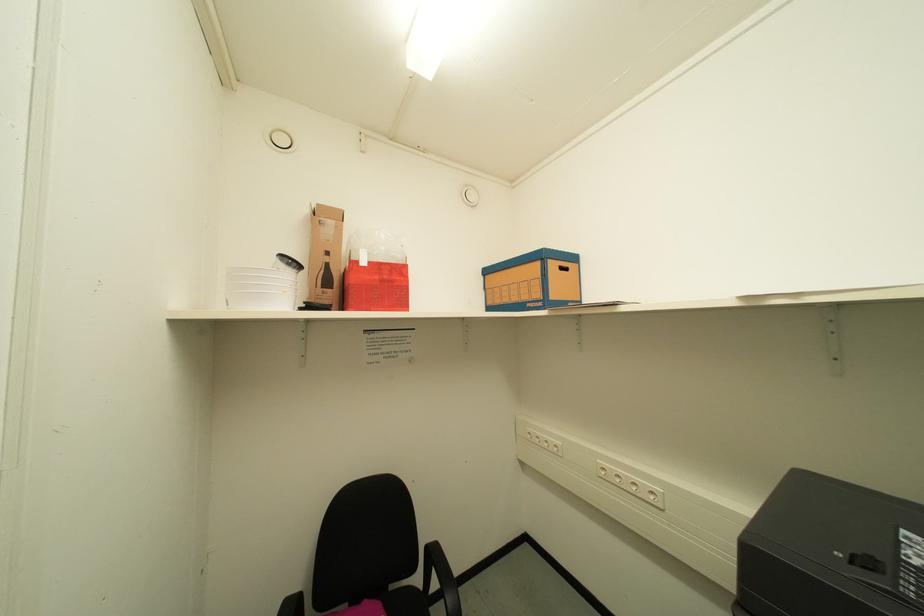
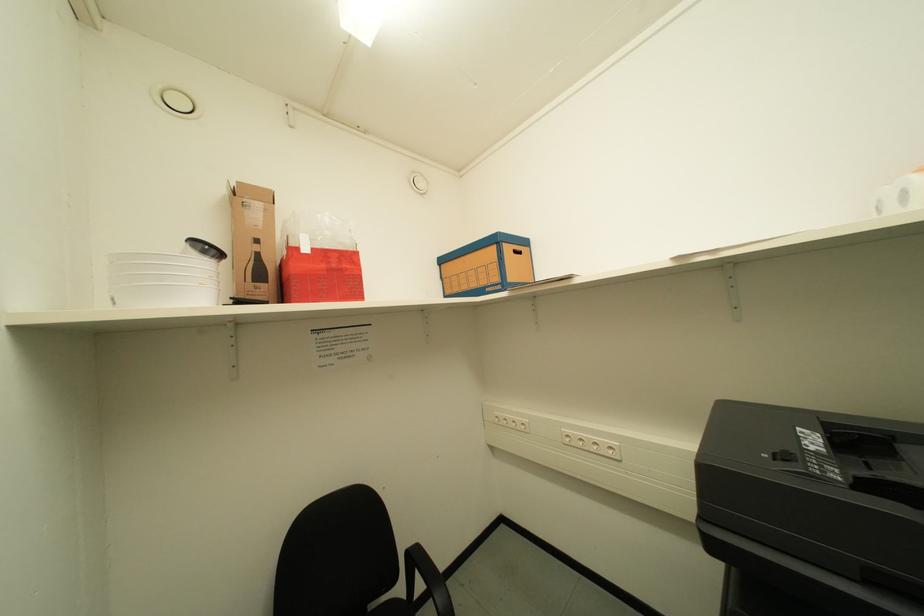
Which direction would the cameraman need to move to produce the second image?

The movement direction of the cameraman is left, forward.